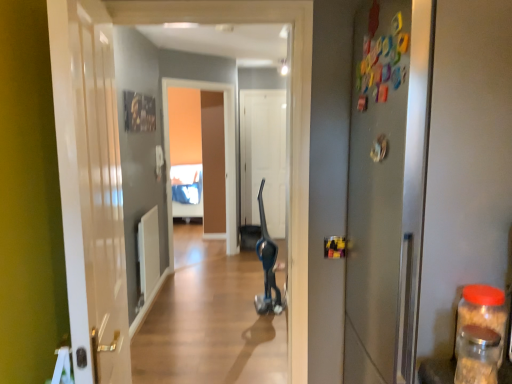
Question: Is point (108, 13) positioned closer to the camera than point (369, 82)?

Choices:
 (A) farther
 (B) closer

Answer: (A)

Question: Is white glossy door at left, placed as the third door when sorted from back to front, wider or thinner than metallic gray door at right, the first door from the right?

Choices:
 (A) thin
 (B) wide

Answer: (A)

Question: Which object is positioned farthest from the white matte door at center, arranged as the second door when viewed from the right?

Choices:
 (A) transparent plastic jar at right, acting as the first bottle starting from the back
 (B) wooden floor at center
 (C) transparent glass jar at right, the 1th bottle viewed from the front
 (D) metallic gray door at right, the first door from the right
 (E) white glossy door at left, which ranks as the third door in right-to-left order

Answer: (C)

Question: Which object is positioned farthest from the wooden floor at center?

Choices:
 (A) metallic gray door at right, positioned as the second door in front-to-back order
 (B) white matte door at center, arranged as the second door when viewed from the right
 (C) white glossy door at left, which ranks as the first door in front-to-back order
 (D) transparent plastic jar at right, acting as the first bottle starting from the back
 (E) transparent glass jar at right, the 1th bottle viewed from the front

Answer: (E)